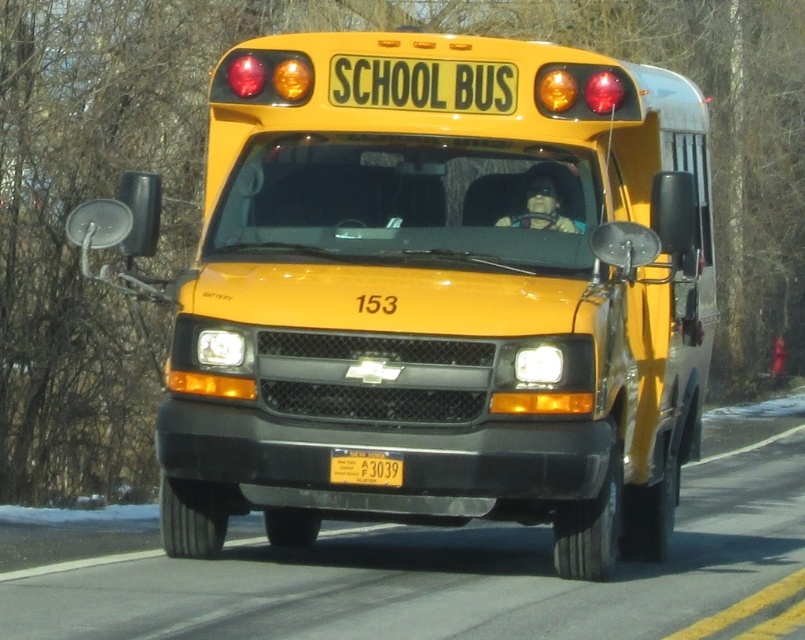
Question: Which object is farther from the camera taking this photo?

Choices:
 (A) yellow matte school bus at center
 (B) yellow matte license plate at center

Answer: (A)

Question: Where is yellow matte school bus at center located in relation to yellow matte license plate at center in the image?

Choices:
 (A) right
 (B) left

Answer: (A)

Question: Can you confirm if yellow matte school bus at center is thinner than yellow matte license plate at center?

Choices:
 (A) no
 (B) yes

Answer: (A)

Question: Does yellow matte school bus at center come in front of yellow matte license plate at center?

Choices:
 (A) yes
 (B) no

Answer: (B)

Question: Which point appears farthest from the camera in this image?

Choices:
 (A) (395, 483)
 (B) (634, 144)

Answer: (B)

Question: Which object is closer to the camera taking this photo?

Choices:
 (A) yellow matte license plate at center
 (B) yellow matte school bus at center

Answer: (A)